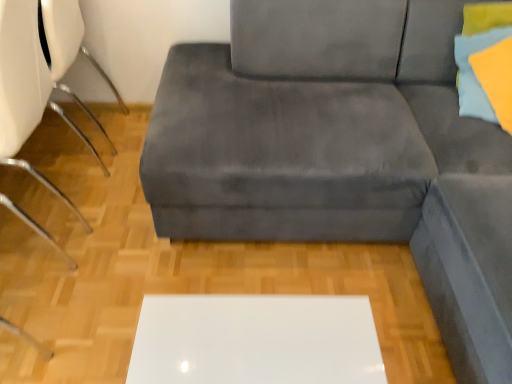
Question: From the image's perspective, is velvet gray couch at center located above white plastic chair at left?

Choices:
 (A) yes
 (B) no

Answer: (B)

Question: Is velvet gray couch at center at the left side of white plastic chair at left?

Choices:
 (A) yes
 (B) no

Answer: (B)

Question: Can you confirm if velvet gray couch at center is wider than white plastic chair at left?

Choices:
 (A) yes
 (B) no

Answer: (A)

Question: Is velvet gray couch at center not inside white plastic chair at left?

Choices:
 (A) yes
 (B) no

Answer: (A)

Question: Does velvet gray couch at center lie behind white plastic chair at left?

Choices:
 (A) yes
 (B) no

Answer: (A)

Question: From the image's perspective, is white plastic swivel chair at left located above or below matte yellow pillow at upper right?

Choices:
 (A) above
 (B) below

Answer: (A)

Question: From a real-world perspective, is white plastic swivel chair at left positioned above or below matte yellow pillow at upper right?

Choices:
 (A) above
 (B) below

Answer: (B)

Question: In terms of width, does white plastic swivel chair at left look wider or thinner when compared to matte yellow pillow at upper right?

Choices:
 (A) thin
 (B) wide

Answer: (B)

Question: Visually, is white plastic swivel chair at left positioned to the left or to the right of matte yellow pillow at upper right?

Choices:
 (A) left
 (B) right

Answer: (A)

Question: From a real-world perspective, is white plastic swivel chair at left positioned above or below white plastic chair at left?

Choices:
 (A) above
 (B) below

Answer: (B)

Question: Is point (105, 135) positioned closer to the camera than point (29, 61)?

Choices:
 (A) closer
 (B) farther

Answer: (B)

Question: Considering the positions of white plastic swivel chair at left and white plastic chair at left in the image, is white plastic swivel chair at left wider or thinner than white plastic chair at left?

Choices:
 (A) thin
 (B) wide

Answer: (A)

Question: Considering the positions of white plastic swivel chair at left and white plastic chair at left in the image, is white plastic swivel chair at left taller or shorter than white plastic chair at left?

Choices:
 (A) short
 (B) tall

Answer: (A)

Question: In terms of width, does white plastic chair at left look wider or thinner when compared to velvet gray couch at center?

Choices:
 (A) thin
 (B) wide

Answer: (A)

Question: Would you say white plastic chair at left is to the left or to the right of velvet gray couch at center in the picture?

Choices:
 (A) right
 (B) left

Answer: (B)